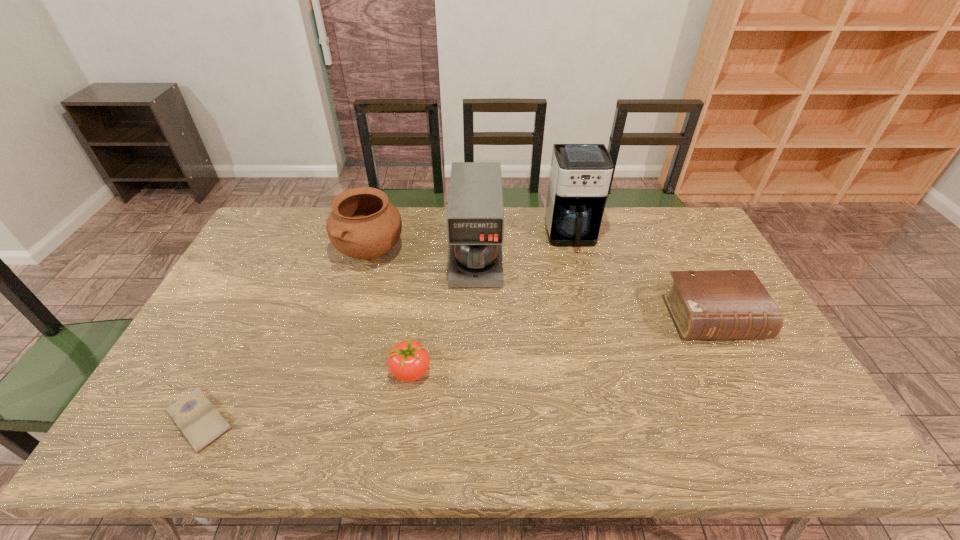
Find the location of a particular element. The height and width of the screenshot is (540, 960). the tallest object is located at coordinates pos(580,174).

What are the coordinates of `the right coffee maker` in the screenshot? It's located at (580, 174).

Identify the location of the second tallest object. This screenshot has width=960, height=540. (475, 215).

In order to click on the shorter coffee maker in this screenshot , I will do `click(475, 215)`.

Identify the location of pottery. This screenshot has height=540, width=960. (363, 224).

Identify the location of the fifth object from right to left. Image resolution: width=960 pixels, height=540 pixels. (363, 224).

Identify the location of the third nearest object. The width and height of the screenshot is (960, 540). (722, 304).

Locate an element on the screen. This screenshot has height=540, width=960. the rightmost object is located at coordinates (722, 304).

Identify the location of tomato. (408, 361).

The image size is (960, 540). Find the location of `the fifth farthest object`. the fifth farthest object is located at coordinates (408, 361).